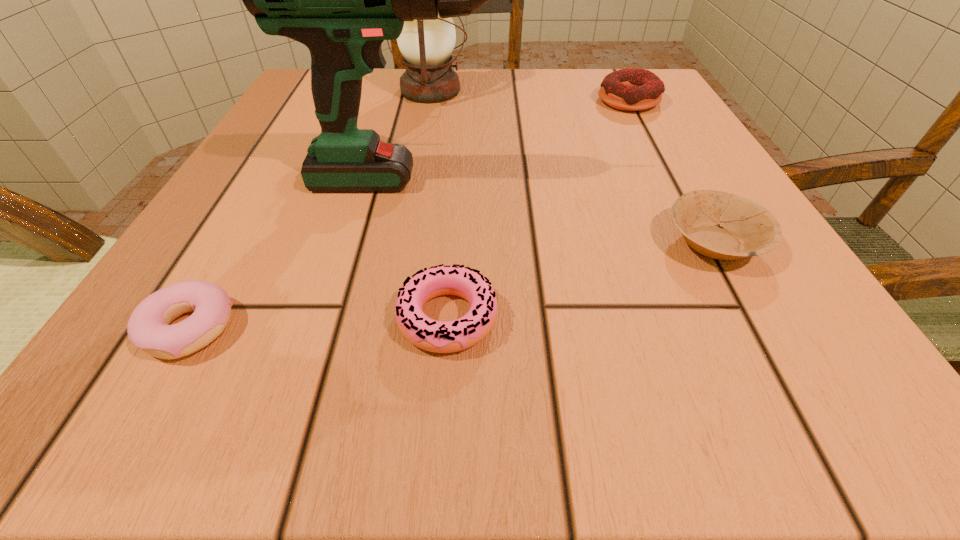
Locate an element on the screen. oil lamp is located at coordinates (426, 45).

Locate an element on the screen. the fourth nearest object is located at coordinates (341, 0).

Find the location of `the third tallest object`. the third tallest object is located at coordinates (629, 89).

Identify the location of the farthest doughnut. (629, 89).

Locate an element on the screen. The height and width of the screenshot is (540, 960). the fourth farthest object is located at coordinates (746, 228).

Find the location of a particular element. This screenshot has width=960, height=540. the second doughnut from left to right is located at coordinates (425, 333).

What are the coordinates of `the leftmost object` in the screenshot? It's located at (148, 328).

Identify the location of vacant space situated on the right of the oil lamp. Image resolution: width=960 pixels, height=540 pixels. click(609, 91).

Find the location of a particular element. The width and height of the screenshot is (960, 540). free space located on the handle side of the drill is located at coordinates (665, 181).

At what (x,y) coordinates should I click in order to perform the action: click on free space located 0.280m on the front of the rightmost doughnut. Please return your answer as a coordinate pair (x, y). This screenshot has height=540, width=960. Looking at the image, I should click on (685, 208).